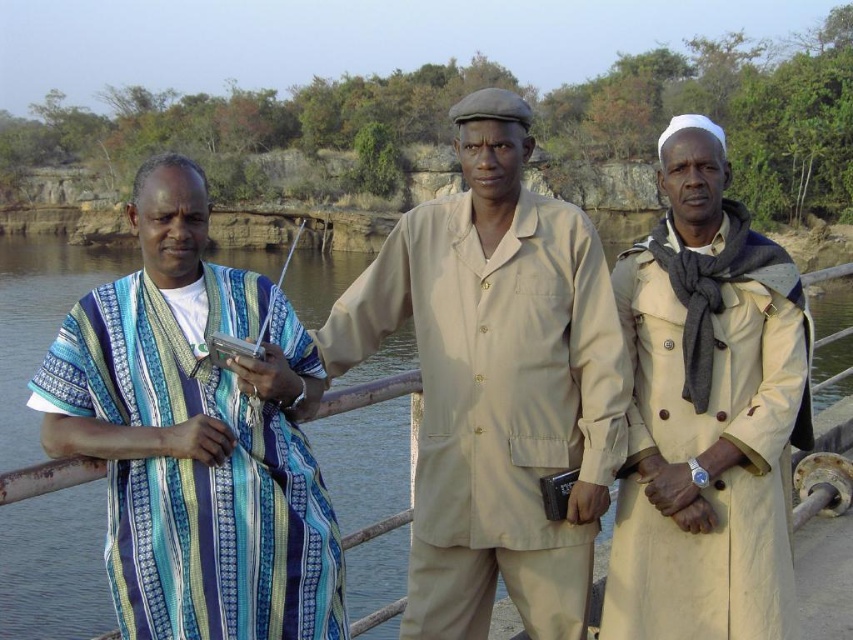
You are a photographer trying to capture a group photo of the blue striped fabric at left and the beige cotton trench coat at right. Given that your camera has a maximum focus range of 5 meters, will you be able to include both objects in a single focused shot?

The blue striped fabric at left and the beige cotton trench coat at right are 6.00 meters apart. Since the camera can only focus up to 5 meters, the distance between them exceeds the focus range, so you cannot capture both in a single focused shot.

You are standing at the point marked by the coordinates point [463,465]. You want to walk straight towards the central figure dressed in a beige buttoned shirt and matching trousers. How far will you have to walk to reach him?

The point [463,465] is 14.95 meters away from the viewer, so you would need to walk 14.95 meters to reach the central figure dressed in a beige buttoned shirt and matching trousers.